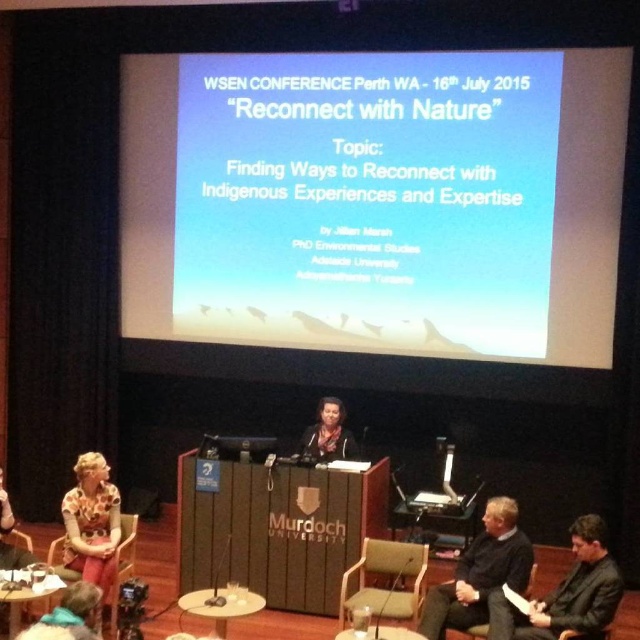
Question: Is white matte projector screen at upper center above matte wood round table at lower center?

Choices:
 (A) no
 (B) yes

Answer: (B)

Question: Which point is closer to the camera?

Choices:
 (A) matte wood round table at lower center
 (B) black fabric jacket at lower right

Answer: (A)

Question: From the image, what is the correct spatial relationship of white matte projector screen at upper center in relation to leather at lower right?

Choices:
 (A) above
 (B) below

Answer: (A)

Question: Which object appears closest to the camera in this image?

Choices:
 (A) black leather jacket at lower right
 (B) black leather chair at lower right

Answer: (B)

Question: Among these points, which one is nearest to the camera?

Choices:
 (A) (602, 636)
 (B) (86, 490)

Answer: (A)

Question: Can you confirm if black fabric jacket at lower right is smaller than matte wood round table at lower center?

Choices:
 (A) yes
 (B) no

Answer: (B)